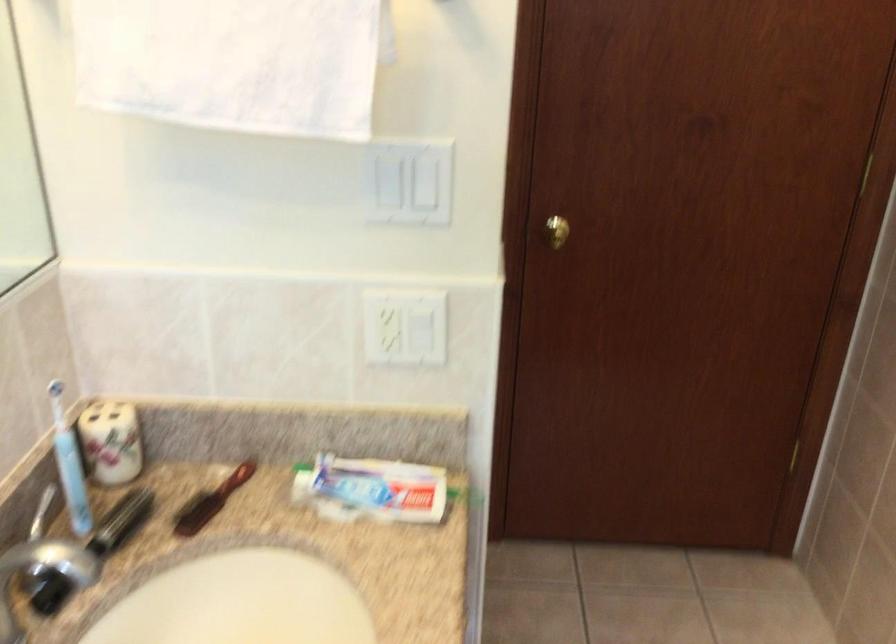
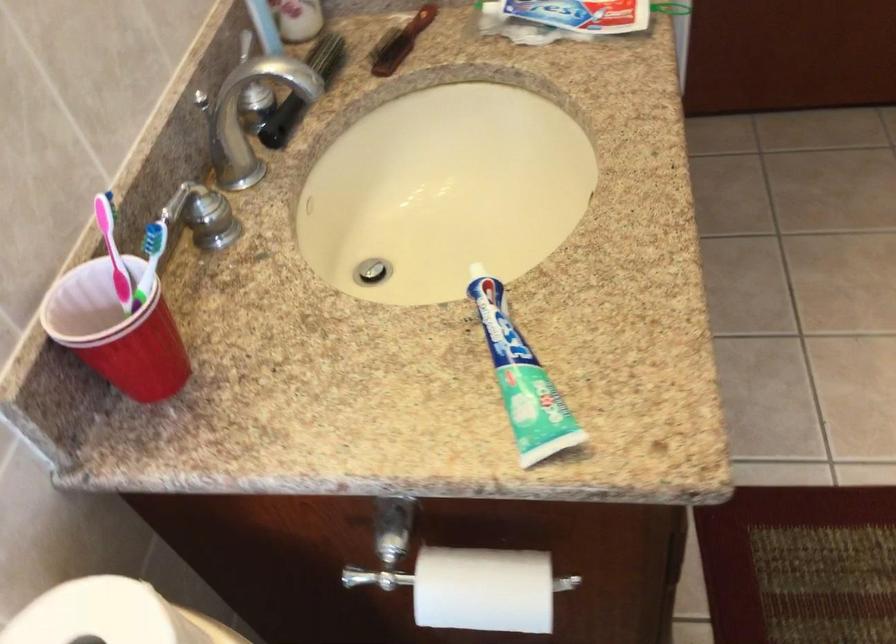
Find the pixel in the second image that matches (x=110, y=466) in the first image.

(297, 19)